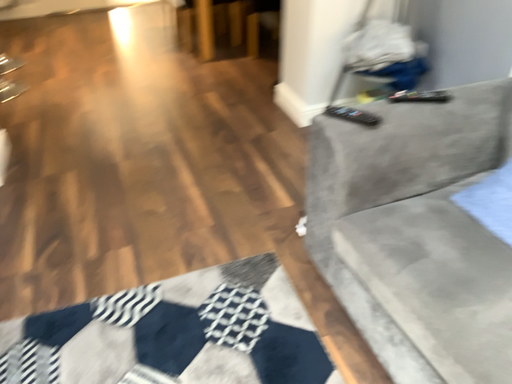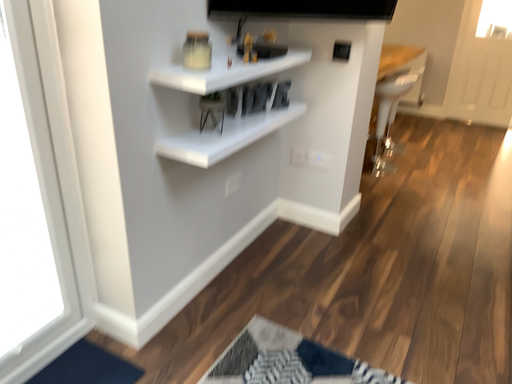
Question: How did the camera likely rotate when shooting the video?

Choices:
 (A) rotated left
 (B) rotated right

Answer: (A)